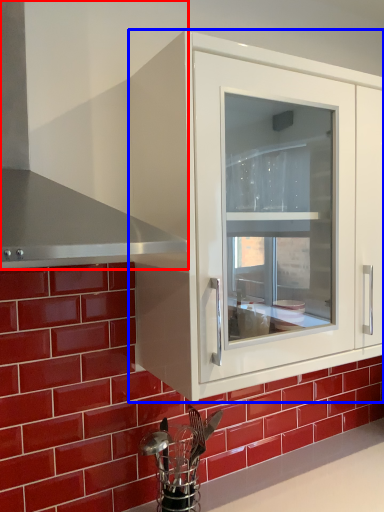
Question: Which of the following is the farthest to the observer, exhaust hood (highlighted by a red box) or cabinetry (highlighted by a blue box)?

Choices:
 (A) exhaust hood
 (B) cabinetry

Answer: (B)